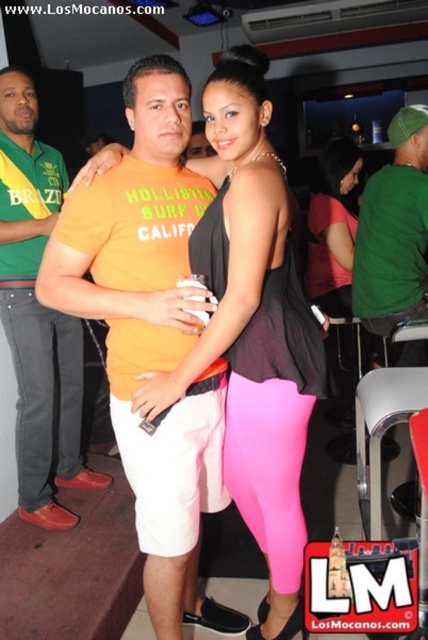
Question: Where is matte yellow t-shirt at center located in relation to pink matte leggings at center in the image?

Choices:
 (A) below
 (B) above

Answer: (A)

Question: Which point is closer to the camera taking this photo?

Choices:
 (A) (392, 312)
 (B) (232, 138)
 (C) (186, 476)

Answer: (B)

Question: Observing the image, what is the correct spatial positioning of orange cotton t-shirt at center in reference to matte black top at center?

Choices:
 (A) left
 (B) right

Answer: (A)

Question: Which object appears closest to the camera in this image?

Choices:
 (A) matte yellow t-shirt at center
 (B) pink matte leggings at center

Answer: (A)

Question: Observing the image, what is the correct spatial positioning of matte black top at center in reference to pink matte leggings at center?

Choices:
 (A) right
 (B) left

Answer: (B)

Question: Which of the following is the closest to the observer?

Choices:
 (A) green matte shirt at right
 (B) orange cotton t-shirt at center
 (C) matte yellow t-shirt at center
 (D) matte black top at center

Answer: (D)